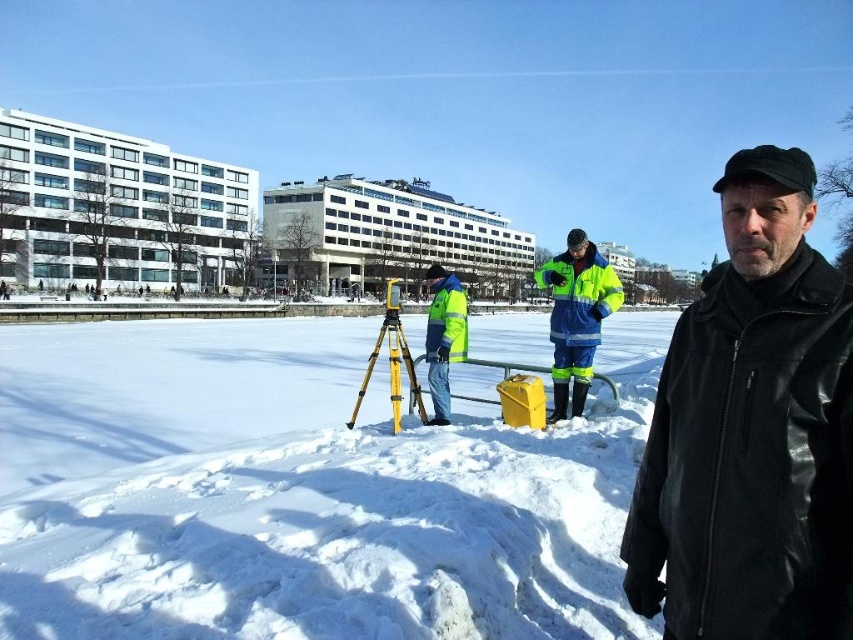
Question: Which point is closer to the camera taking this photo?

Choices:
 (A) (708, 380)
 (B) (578, 387)
 (C) (508, 554)

Answer: (A)

Question: Is black leather jacket at center bigger than yellow matte tripod at center?

Choices:
 (A) no
 (B) yes

Answer: (A)

Question: Among these objects, which one is farthest from the camera?

Choices:
 (A) high-visibility fabric jacket at center
 (B) black leather jacket at center

Answer: (A)

Question: Which object is closer to the camera taking this photo?

Choices:
 (A) black leather jacket at center
 (B) white powdery snow at center

Answer: (A)

Question: Can you confirm if high-visibility fabric jacket at center is bigger than yellow matte tripod at center?

Choices:
 (A) yes
 (B) no

Answer: (B)

Question: Can you confirm if high-visibility fabric jacket at center is bigger than yellow matte tripod at center?

Choices:
 (A) no
 (B) yes

Answer: (A)